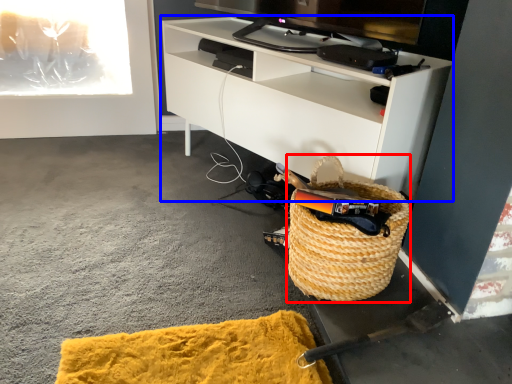
Question: Which of the following is the farthest to the observer, picnic basket (highlighted by a red box) or cabinetry (highlighted by a blue box)?

Choices:
 (A) picnic basket
 (B) cabinetry

Answer: (B)